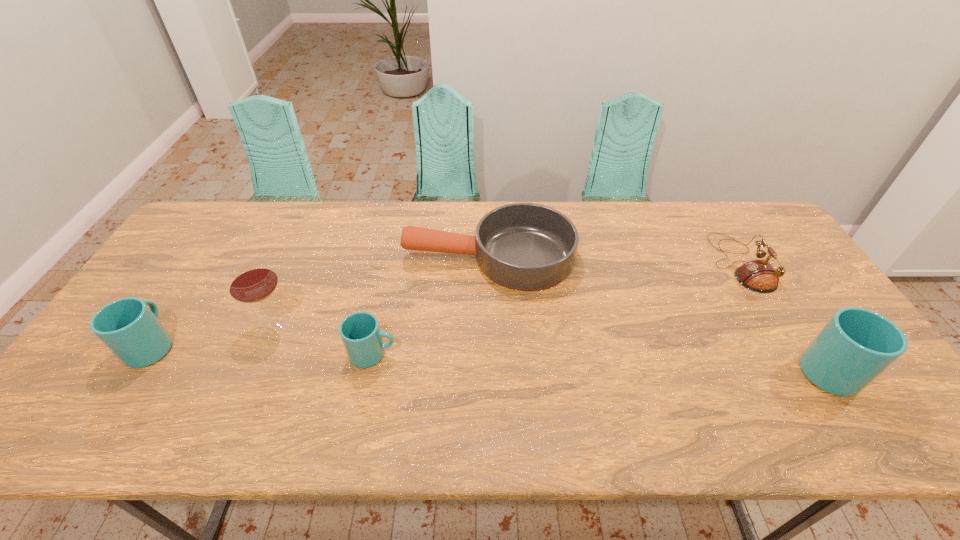
Where is `telephone that is at the far edge`? Image resolution: width=960 pixels, height=540 pixels. telephone that is at the far edge is located at coordinates (759, 276).

Locate an element on the screen. object that is at the left edge is located at coordinates (128, 327).

Where is `cup situated at the right edge`? This screenshot has height=540, width=960. cup situated at the right edge is located at coordinates (856, 345).

Where is `telephone at the right edge`? Image resolution: width=960 pixels, height=540 pixels. telephone at the right edge is located at coordinates (759, 276).

Find the location of a particular element. Image resolution: width=960 pixels, height=540 pixels. object positioned at the near left corner is located at coordinates (128, 327).

Locate an element on the screen. object at the far right corner is located at coordinates (759, 276).

I want to click on object that is at the near right corner, so click(x=856, y=345).

Identify the location of free location at the far edge of the desktop. This screenshot has width=960, height=540. coord(674,221).

Locate an element on the screen. The image size is (960, 540). free spot at the near edge of the desktop is located at coordinates (730, 397).

At what (x,y) coordinates should I click in order to perform the action: click on vacant space at the right edge of the desktop. Please return your answer as a coordinate pair (x, y). This screenshot has width=960, height=540. Looking at the image, I should click on (809, 323).